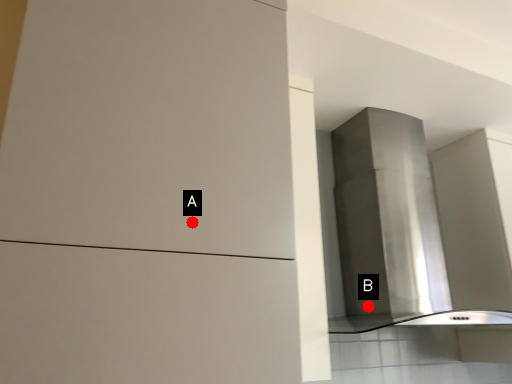
Question: Two points are circled on the image, labeled by A and B beside each circle. Which point is closer to the camera taking this photo?

Choices:
 (A) A is closer
 (B) B is closer

Answer: (A)